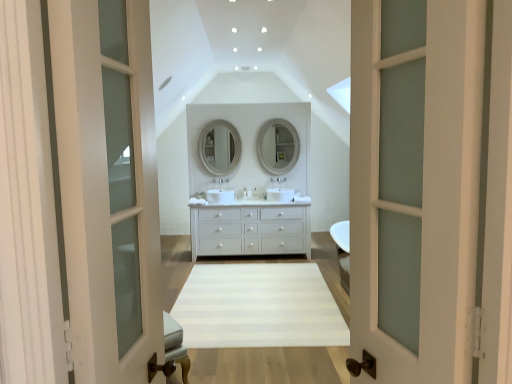
Question: Does matte silver faucet at center, marked as the 2th faucet in a left-to-right arrangement, have a lesser width compared to white matte chest of drawers at center?

Choices:
 (A) yes
 (B) no

Answer: (A)

Question: Is matte silver faucet at center, the 1th faucet in the right-to-left sequence, located outside white matte chest of drawers at center?

Choices:
 (A) yes
 (B) no

Answer: (A)

Question: Is matte silver faucet at center, marked as the 2th faucet in a left-to-right arrangement, further to camera compared to white matte chest of drawers at center?

Choices:
 (A) yes
 (B) no

Answer: (A)

Question: Can you confirm if matte silver faucet at center, marked as the 2th faucet in a left-to-right arrangement, is positioned to the right of white matte chest of drawers at center?

Choices:
 (A) no
 (B) yes

Answer: (A)

Question: Is matte silver faucet at center, marked as the 2th faucet in a left-to-right arrangement, taller than white matte chest of drawers at center?

Choices:
 (A) yes
 (B) no

Answer: (B)

Question: Is point (407, 205) closer or farther from the camera than point (215, 178)?

Choices:
 (A) farther
 (B) closer

Answer: (B)

Question: In the image, is white frosted glass door at center on the left side or the right side of satin nickel faucet at center, the second faucet when ordered from right to left?

Choices:
 (A) left
 (B) right

Answer: (B)

Question: In the image, is white frosted glass door at center positioned in front of or behind satin nickel faucet at center, acting as the first faucet starting from the left?

Choices:
 (A) front
 (B) behind

Answer: (A)

Question: From a real-world perspective, is white frosted glass door at center positioned above or below satin nickel faucet at center, acting as the first faucet starting from the left?

Choices:
 (A) below
 (B) above

Answer: (B)

Question: Considering the positions of satin nickel faucet at center, the second faucet when ordered from right to left, and white glossy sink at center in the image, is satin nickel faucet at center, the second faucet when ordered from right to left, wider or thinner than white glossy sink at center?

Choices:
 (A) thin
 (B) wide

Answer: (A)

Question: Is satin nickel faucet at center, acting as the first faucet starting from the left, to the left or to the right of white glossy sink at center in the image?

Choices:
 (A) left
 (B) right

Answer: (A)

Question: Relative to white glossy sink at center, is satin nickel faucet at center, the second faucet when ordered from right to left, in front or behind?

Choices:
 (A) behind
 (B) front

Answer: (A)

Question: Based on their sizes in the image, would you say satin nickel faucet at center, acting as the first faucet starting from the left, is bigger or smaller than white glossy sink at center?

Choices:
 (A) big
 (B) small

Answer: (B)

Question: Considering the positions of white striped rug at center and white glossy sink at center in the image, is white striped rug at center bigger or smaller than white glossy sink at center?

Choices:
 (A) big
 (B) small

Answer: (A)

Question: From a real-world perspective, is white striped rug at center above or below white glossy sink at center?

Choices:
 (A) above
 (B) below

Answer: (B)